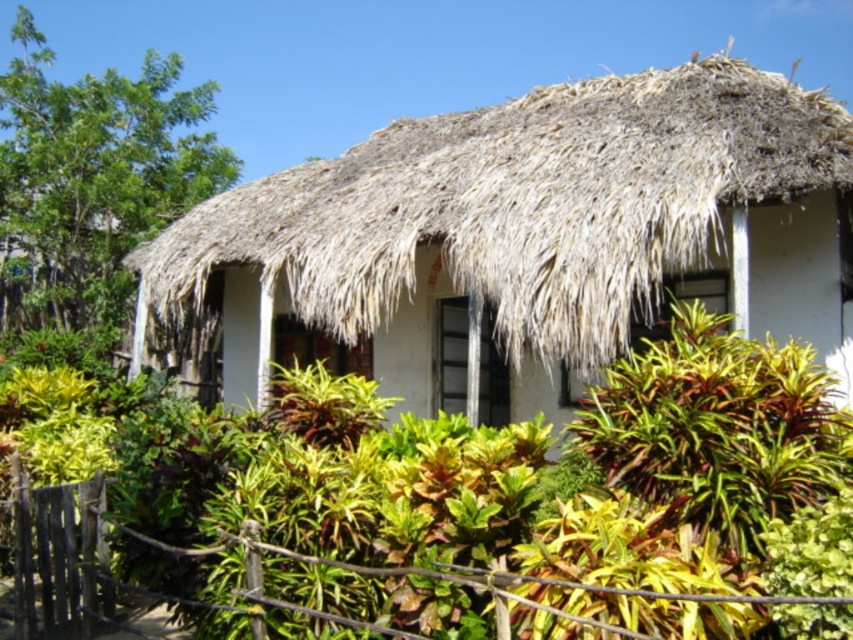
Question: Is white thatch hut at center wider than wooden fence at lower center?

Choices:
 (A) no
 (B) yes

Answer: (B)

Question: Among these points, which one is farthest from the camera?

Choices:
 (A) (399, 202)
 (B) (78, 561)

Answer: (A)

Question: Based on their relative distances, which object is nearer to the green leafy tree at upper left?

Choices:
 (A) wooden fence at lower center
 (B) white thatch hut at center

Answer: (B)

Question: Does white thatch hut at center have a greater width compared to wooden fence at lower center?

Choices:
 (A) yes
 (B) no

Answer: (A)

Question: Can you confirm if white thatch hut at center is positioned to the left of green leafy tree at upper left?

Choices:
 (A) no
 (B) yes

Answer: (A)

Question: Which object is farther from the camera taking this photo?

Choices:
 (A) wooden fence at lower center
 (B) green leafy tree at upper left
 (C) white thatch hut at center

Answer: (B)